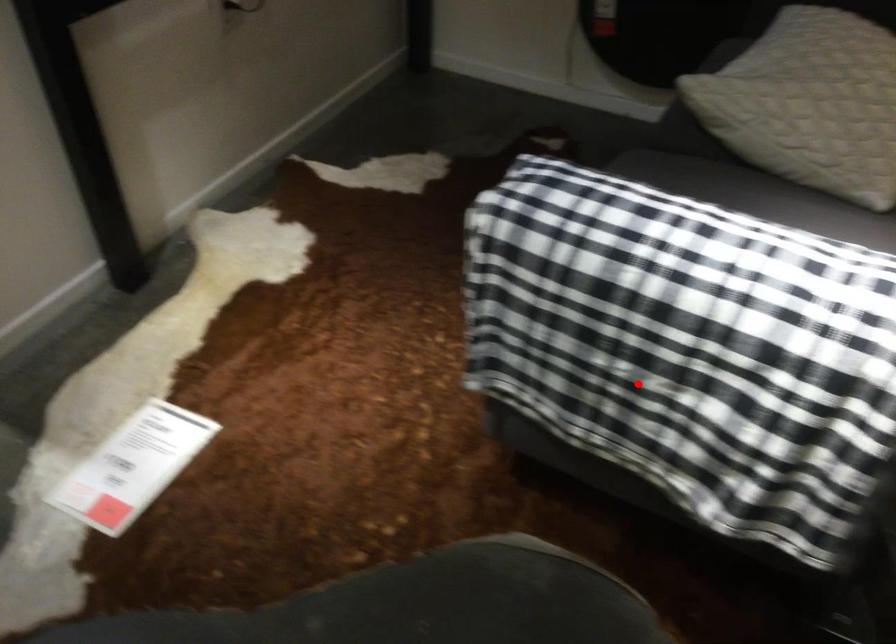
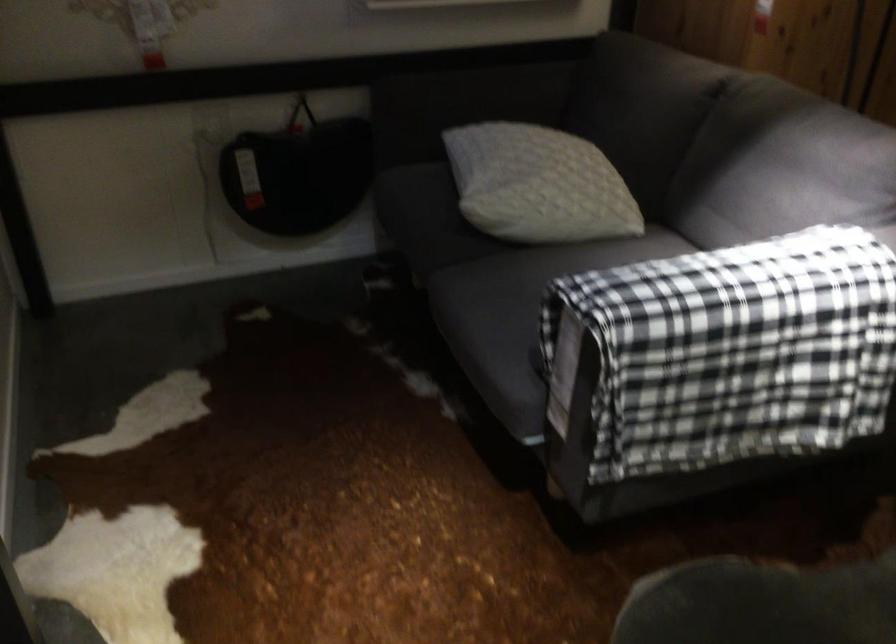
Question: A red point is marked in image1. In image2, is the corresponding 3D point closer to the camera or farther? Reply with the corresponding letter.

Choices:
 (A) The corresponding 3D point is closer.
 (B) The corresponding 3D point is farther.

Answer: (B)